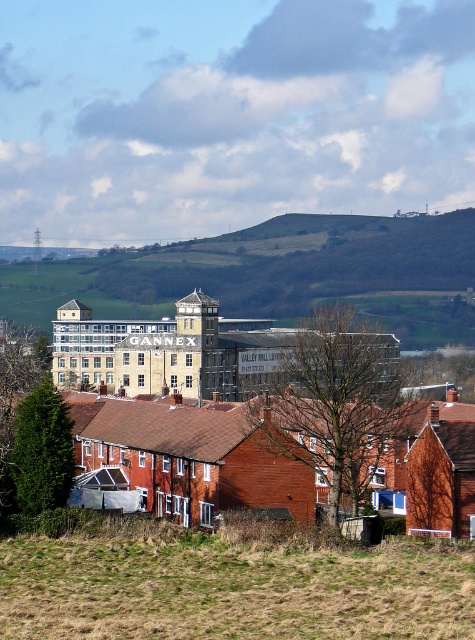
Question: Which point is closer to the camera?

Choices:
 (A) yellow brick building at center
 (B) green leafy tree at lower left
 (C) bare branches at center

Answer: (A)

Question: Among these points, which one is nearest to the camera?

Choices:
 (A) (38, 465)
 (B) (108, 445)

Answer: (A)

Question: Is yellow brick building at center positioned behind green leafy tree at lower left?

Choices:
 (A) no
 (B) yes

Answer: (A)

Question: Which object is positioned farthest from the green leafy tree at lower left?

Choices:
 (A) bare branches at center
 (B) yellow brick building at center

Answer: (B)

Question: Is yellow brick building at center wider than green leafy tree at lower left?

Choices:
 (A) no
 (B) yes

Answer: (B)

Question: Is yellow brick building at center positioned behind green leafy tree at lower left?

Choices:
 (A) no
 (B) yes

Answer: (A)